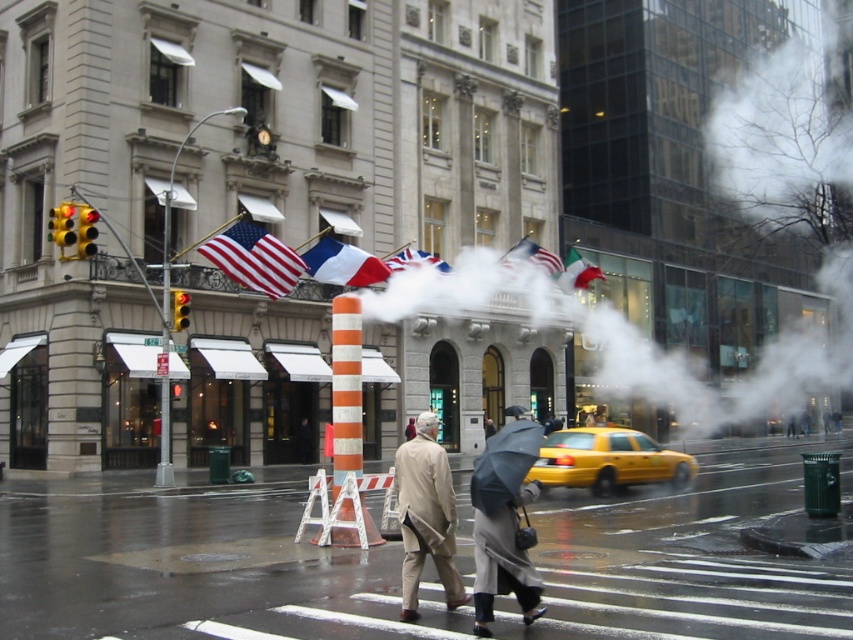
Question: Estimate the real-world distances between objects in this image. Which object is closer to the red fabric flag at center?

Choices:
 (A) matte fabric flag at upper center
 (B) blue and white striped fabric flag at center
 (C) beige wool coat at center
 (D) white plastic traffic cone at center

Answer: (B)

Question: Can you confirm if matte fabric flag at upper center is positioned below black matte umbrella at center?

Choices:
 (A) yes
 (B) no

Answer: (B)

Question: Does dark gray wool coat at center lie in front of matte green flag at center?

Choices:
 (A) yes
 (B) no

Answer: (A)

Question: In this image, where is white plastic traffic cone at center located relative to matte white flag at center?

Choices:
 (A) above
 (B) below

Answer: (B)

Question: Which object is farther from the camera taking this photo?

Choices:
 (A) matte green flag at center
 (B) white steam at center
 (C) matte fabric flag at upper center
 (D) white plastic traffic cone at center

Answer: (A)

Question: Which of the following is the closest to the observer?

Choices:
 (A) yellow rubber taxi at center
 (B) matte green flag at center
 (C) blue and white striped fabric flag at center

Answer: (A)